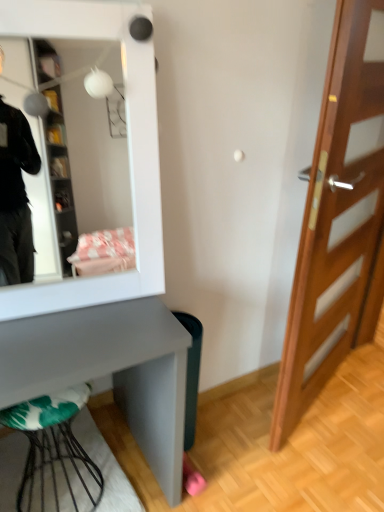
The height and width of the screenshot is (512, 384). Describe the element at coordinates (191, 374) in the screenshot. I see `green plastic trash bin at lower right` at that location.

Describe the element at coordinates (52, 442) in the screenshot. Image resolution: width=384 pixels, height=512 pixels. I see `metallic wire stool at lower left` at that location.

Locate an element on the screen. Image resolution: width=384 pixels, height=512 pixels. green plastic trash bin at lower right is located at coordinates (191, 374).

Which point is more distant from viewer, [28,401] or [313,356]?

The point [313,356] is behind.

Is metallic wire stool at lower left to the left of wooden door at right from the viewer's perspective?

Indeed, metallic wire stool at lower left is positioned on the left side of wooden door at right.

Looking at their sizes, would you say metallic wire stool at lower left is wider or thinner than wooden door at right?

metallic wire stool at lower left is wider than wooden door at right.

This screenshot has height=512, width=384. I want to click on door in front of the metallic wire stool at lower left, so click(x=338, y=218).

From a real-world perspective, who is located higher, wooden door at right or green plastic trash bin at lower right?

wooden door at right.

There is a green plastic trash bin at lower right. Identify the location of door above it (from a real-world perspective). The width and height of the screenshot is (384, 512). (338, 218).

Is green plastic trash bin at lower right inside wooden door at right?

That's incorrect, green plastic trash bin at lower right is not inside wooden door at right.

Is green plastic trash bin at lower right shorter than white glossy mirror at upper left?

Yes, green plastic trash bin at lower right is shorter than white glossy mirror at upper left.

From the image's perspective, is green plastic trash bin at lower right located above or below white glossy mirror at upper left?

Based on their image positions, green plastic trash bin at lower right is located beneath white glossy mirror at upper left.

Could you tell me if green plastic trash bin at lower right is facing white glossy mirror at upper left?

No.

Considering the relative positions of green plastic trash bin at lower right and white glossy mirror at upper left in the image provided, is green plastic trash bin at lower right to the left or to the right of white glossy mirror at upper left?

Based on their positions, green plastic trash bin at lower right is located to the right of white glossy mirror at upper left.

From a real-world perspective, is white glossy mirror at upper left above or below wooden door at right?

white glossy mirror at upper left is situated higher than wooden door at right in the real world.

How many degrees apart are the facing directions of white glossy mirror at upper left and wooden door at right?

The facing directions of white glossy mirror at upper left and wooden door at right are 32.9 degrees apart.

Looking at this image, is the position of white glossy mirror at upper left less distant than that of wooden door at right?

Yes.

Is white glossy mirror at upper left taller than wooden door at right?

In fact, white glossy mirror at upper left may be shorter than wooden door at right.

Between wooden door at right and metallic wire stool at lower left, which one is positioned behind?

Positioned behind is metallic wire stool at lower left.

Is point (331, 51) in front of point (30, 472)?

Yes, it is in front of point (30, 472).

Does wooden door at right have a lesser height compared to metallic wire stool at lower left?

Incorrect, the height of wooden door at right does not fall short of that of metallic wire stool at lower left.

Which is more to the left, wooden door at right or metallic wire stool at lower left?

metallic wire stool at lower left is more to the left.

From the image's perspective, is metallic wire stool at lower left on green plastic trash bin at lower right?

Incorrect, from the image's perspective, metallic wire stool at lower left is lower than green plastic trash bin at lower right.

Which point is more forward, (23, 492) or (190, 411)?

Point (23, 492)

In terms of width, does metallic wire stool at lower left look wider or thinner when compared to green plastic trash bin at lower right?

metallic wire stool at lower left is wider than green plastic trash bin at lower right.

Does point (56, 453) come in front of point (115, 17)?

That is False.

Which of these two, metallic wire stool at lower left or white glossy mirror at upper left, is thinner?

white glossy mirror at upper left is thinner.

Considering the sizes of metallic wire stool at lower left and white glossy mirror at upper left in the image, is metallic wire stool at lower left bigger or smaller than white glossy mirror at upper left?

In the image, metallic wire stool at lower left appears to be smaller than white glossy mirror at upper left.

How distant is metallic wire stool at lower left from white glossy mirror at upper left?

metallic wire stool at lower left is 37.65 inches from white glossy mirror at upper left.

Identify the location of furniture below the wooden door at right (from a real-world perspective). tap(52, 442).

The image size is (384, 512). I want to click on trash bin/can on the left of wooden door at right, so click(x=191, y=374).

Looking at this image, from the image, which object appears to be nearer to metallic wire stool at lower left, wooden door at right or green plastic trash bin at lower right?

green plastic trash bin at lower right is closer to metallic wire stool at lower left.

Estimate the real-world distances between objects in this image. Which object is further from green plastic trash bin at lower right, white glossy mirror at upper left or metallic wire stool at lower left?

white glossy mirror at upper left.

From the image, which object appears to be nearer to wooden door at right, green plastic trash bin at lower right or metallic wire stool at lower left?

green plastic trash bin at lower right lies closer to wooden door at right than the other object.

Looking at the image, which one is located closer to green plastic trash bin at lower right, wooden door at right or metallic wire stool at lower left?

metallic wire stool at lower left is positioned closer to the anchor green plastic trash bin at lower right.

Based on their spatial positions, is metallic wire stool at lower left or green plastic trash bin at lower right further from wooden door at right?

The object further to wooden door at right is metallic wire stool at lower left.

When comparing their distances from white glossy mirror at upper left, does metallic wire stool at lower left or green plastic trash bin at lower right seem closer?

green plastic trash bin at lower right lies closer to white glossy mirror at upper left than the other object.

When comparing their distances from wooden door at right, does green plastic trash bin at lower right or white glossy mirror at upper left seem further?

white glossy mirror at upper left lies further to wooden door at right than the other object.

Estimate the real-world distances between objects in this image. Which object is further from white glossy mirror at upper left, green plastic trash bin at lower right or metallic wire stool at lower left?

metallic wire stool at lower left lies further to white glossy mirror at upper left than the other object.

The image size is (384, 512). I want to click on trash bin/can between white glossy mirror at upper left and wooden door at right in the horizontal direction, so click(191, 374).

In order to click on trash bin/can between metallic wire stool at lower left and wooden door at right in the horizontal direction in this screenshot , I will do `click(191, 374)`.

The height and width of the screenshot is (512, 384). I want to click on mirror between metallic wire stool at lower left and wooden door at right, so click(129, 151).

This screenshot has height=512, width=384. In order to click on trash bin/can between white glossy mirror at upper left and metallic wire stool at lower left vertically in this screenshot , I will do `click(191, 374)`.